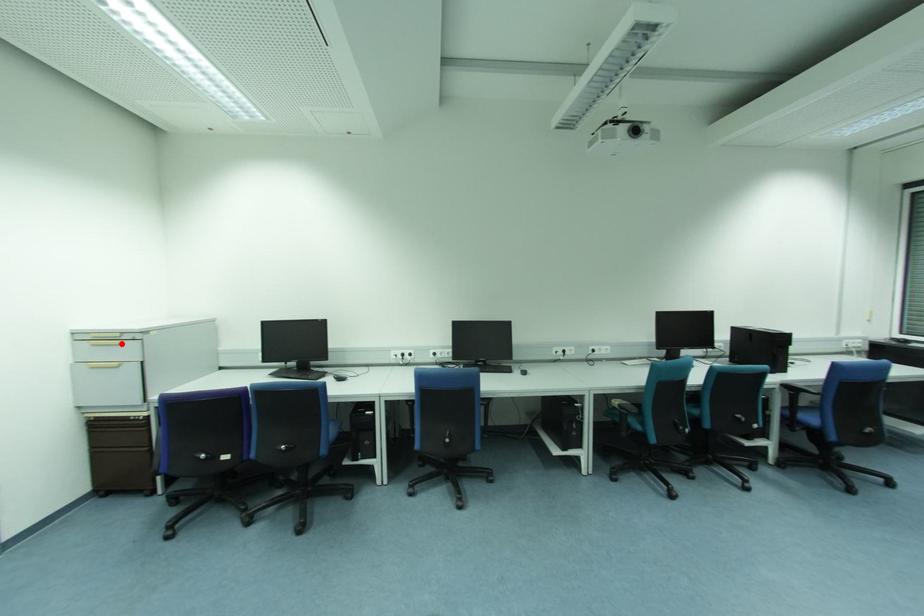
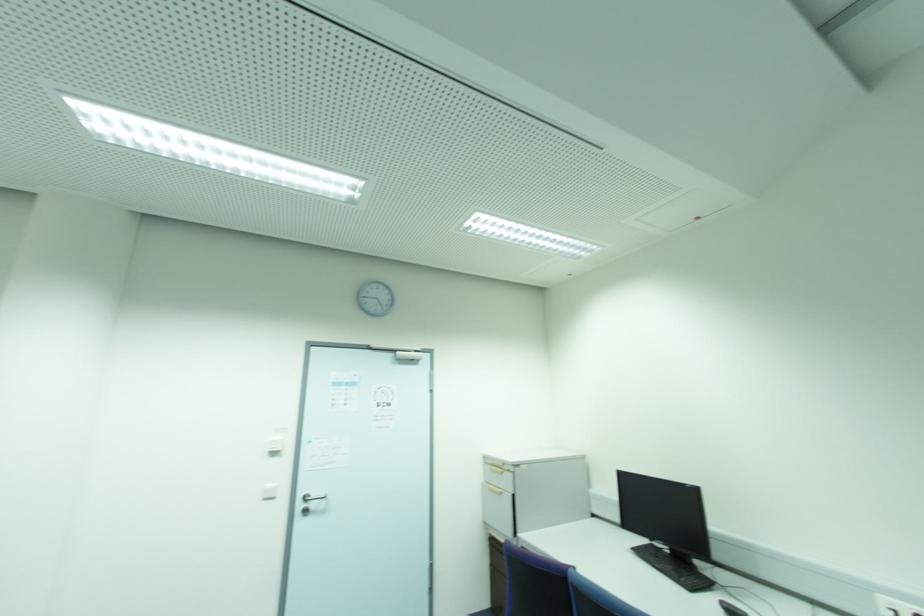
Locate, in the second image, the point that corresponds to the highlighted location in the first image.

(503, 472)